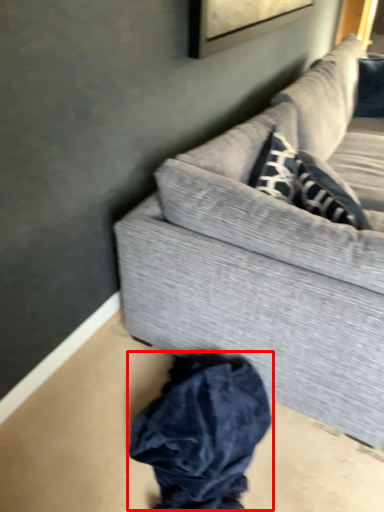
Question: From the image's perspective, what is the correct spatial relationship of clothing (annotated by the red box) in relation to studio couch?

Choices:
 (A) above
 (B) below

Answer: (B)